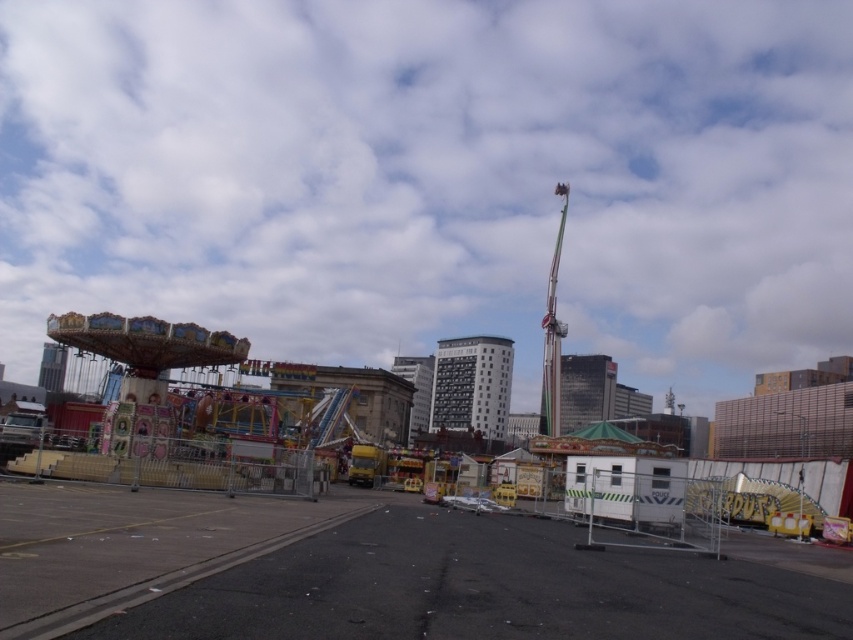
You are a visitor at the amusement park and want to take a photo of the metallic fairground at center and the multicolored painted carousel at left from the best angle. Which object should you position yourself closer to in order to capture both in the frame?

You should position yourself closer to the multicolored painted carousel at left because the metallic fairground at center is to the right of it, allowing both to be included in the frame when positioned near the carousel.

You are standing at the white trailer with the police markings and want to reach the fenced area where the amusement park rides are located. There are two points marked on the path leading to the fence. Which point, point [610,602] or point [167,474], is closer to you as you stand at the trailer?

Point [610,602] is closer to the viewer than point [167,474], so the closer point to you at the trailer would be point [610,602].